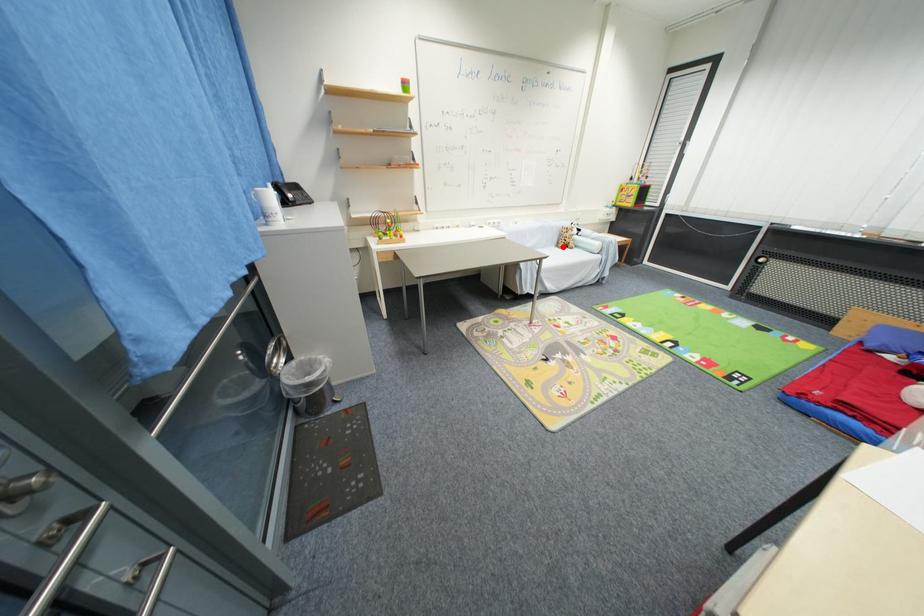
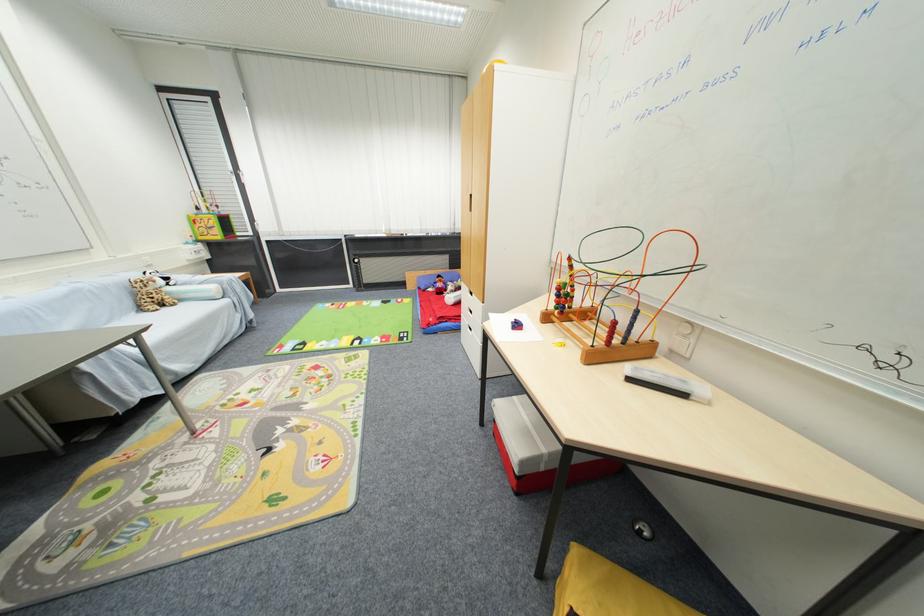
The point at the highlighted location is marked in the first image. Where is the corresponding point in the second image?

(146, 310)